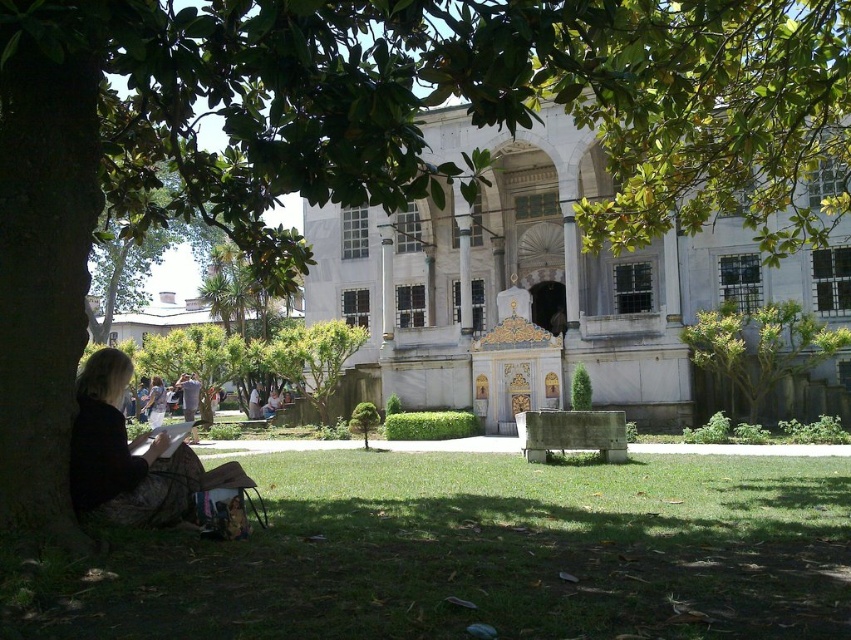
From the picture: Who is shorter, green grass at lower center or denim jacket at lower left?

green grass at lower center

Consider the image. Can you confirm if green grass at lower center is shorter than denim jacket at lower left?

Yes.

Which is behind, point (170, 560) or point (147, 417)?

The point (147, 417) is behind.

This screenshot has width=851, height=640. I want to click on green grass at lower center, so click(486, 554).

Is point (172, 467) behind point (712, 337)?

No, it is not.

Between point (90, 360) and point (758, 401), which one is positioned in front?

Point (90, 360) is in front.

Where is `blonde hair at lower left`? The width and height of the screenshot is (851, 640). blonde hair at lower left is located at coordinates (124, 454).

Is white marble palace at center bigger than green leafy tree at right?

Yes, white marble palace at center is bigger than green leafy tree at right.

The width and height of the screenshot is (851, 640). What do you see at coordinates (537, 273) in the screenshot?
I see `white marble palace at center` at bounding box center [537, 273].

Who is more distant from viewer, (503, 289) or (780, 308)?

The point (503, 289) is behind.

The height and width of the screenshot is (640, 851). Find the location of `white marble palace at center`. white marble palace at center is located at coordinates (537, 273).